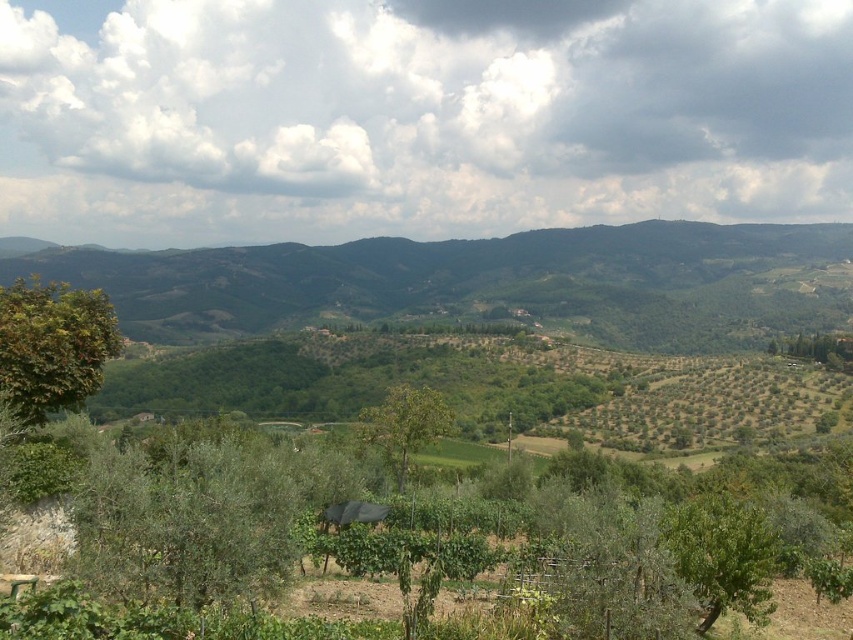
Question: Does green leafy hillside at center appear over green leafy tree at center?

Choices:
 (A) yes
 (B) no

Answer: (A)

Question: Among these objects, which one is nearest to the camera?

Choices:
 (A) green leafy tree at left
 (B) green leafy hillside at center
 (C) green leafy tree at center

Answer: (A)

Question: Does green leafy tree at left have a smaller size compared to green leafy tree at lower right?

Choices:
 (A) yes
 (B) no

Answer: (B)

Question: Which of the following is the farthest from the observer?

Choices:
 (A) green leafy hillside at center
 (B) green leafy tree at center
 (C) green leafy tree at left

Answer: (A)

Question: In this image, where is green leafy hillside at center located relative to green leafy tree at lower right?

Choices:
 (A) left
 (B) right

Answer: (A)

Question: Which is nearer to the green leafy tree at lower right?

Choices:
 (A) green leafy tree at left
 (B) green leafy hillside at center
 (C) green leafy tree at center

Answer: (A)